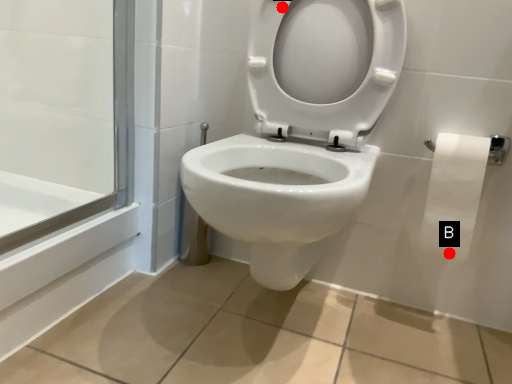
Question: Two points are circled on the image, labeled by A and B beside each circle. Which point is closer to the camera?

Choices:
 (A) A is closer
 (B) B is closer

Answer: (B)